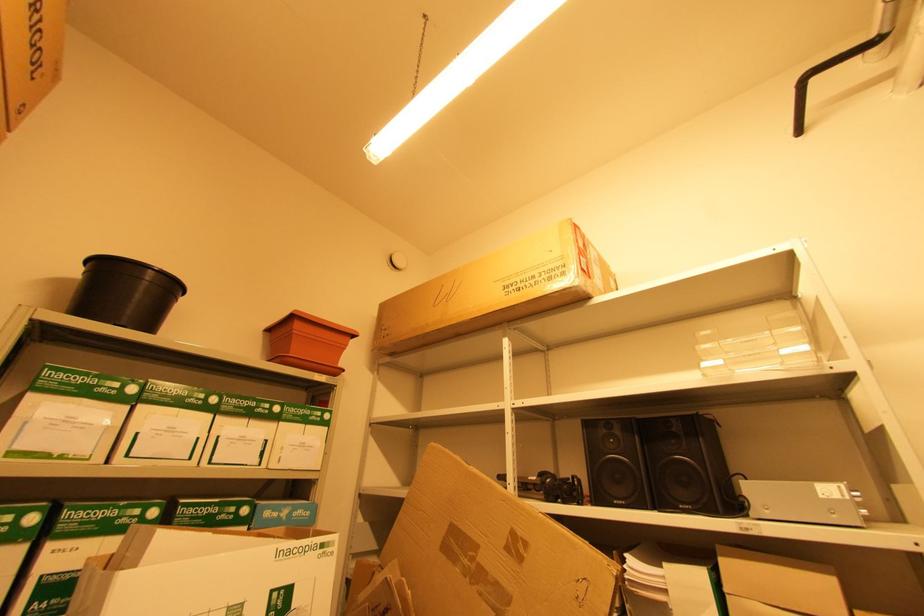
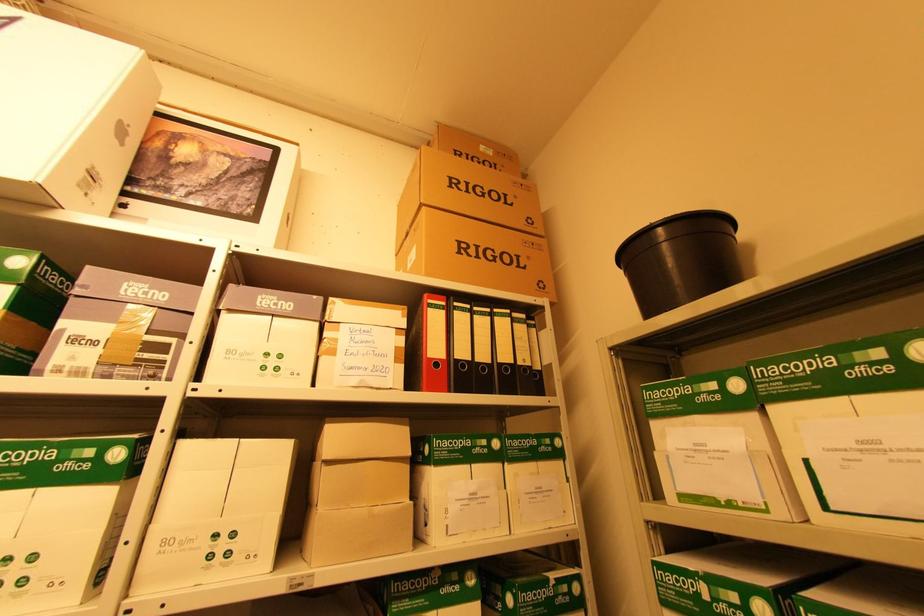
How did the camera likely rotate?

The camera rotated toward left-up.